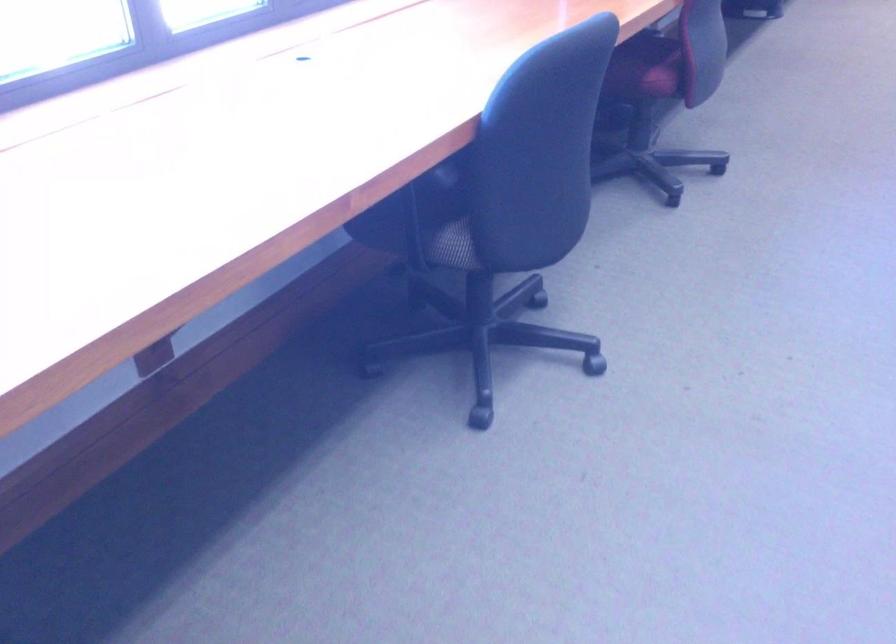
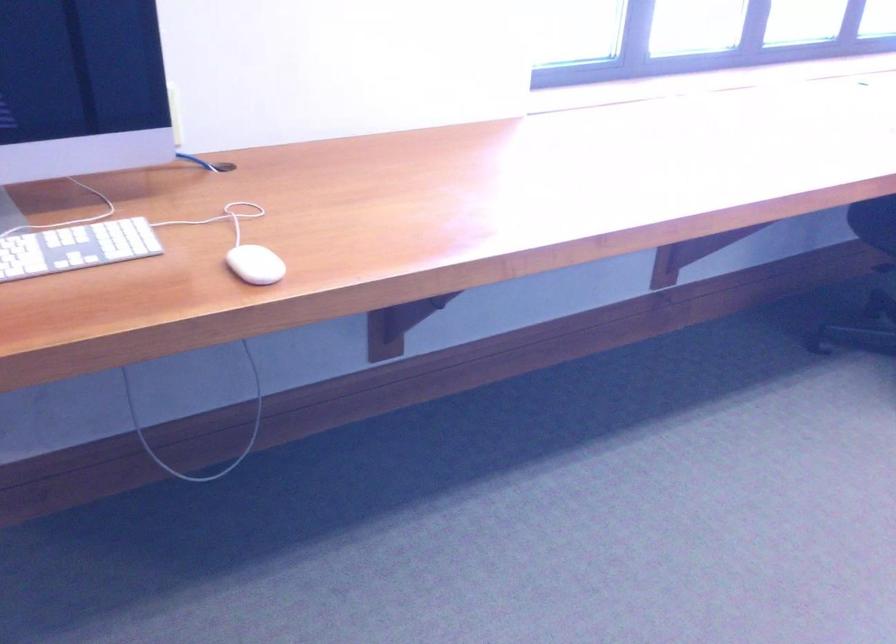
Question: Based on the continuous images, in which direction is the camera rotating? Reply with the corresponding letter.

Choices:
 (A) Left
 (B) Right
 (C) Up
 (D) Down

Answer: (A)